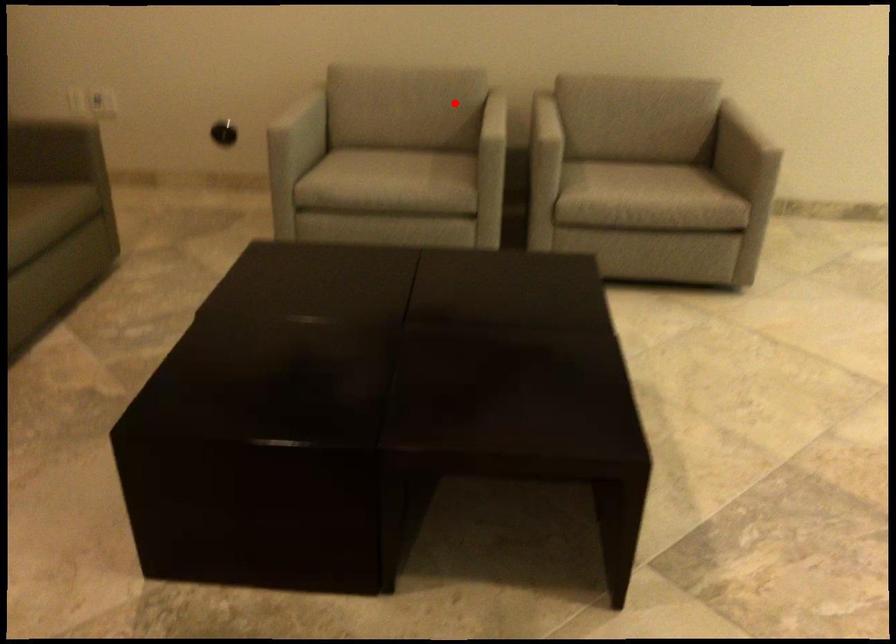
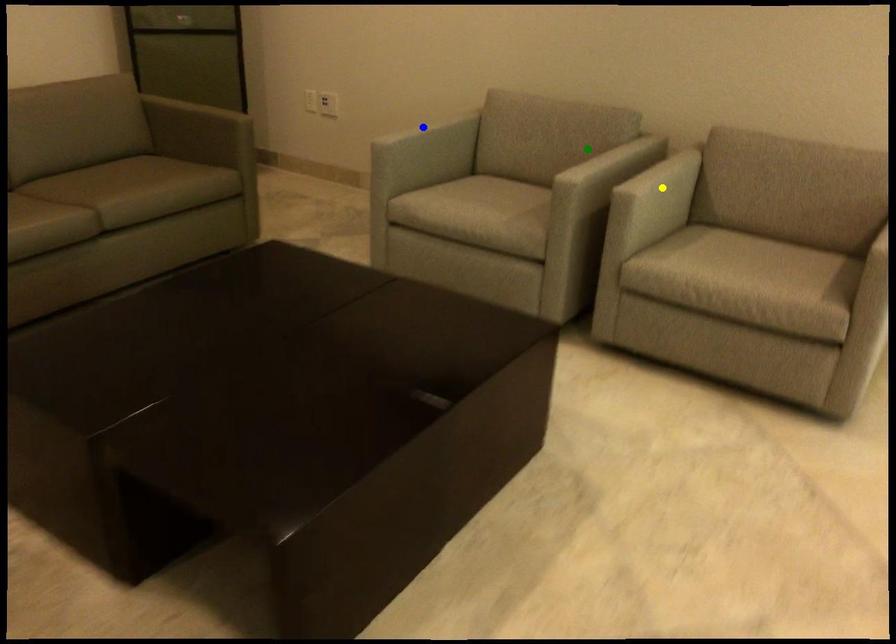
Question: I am providing you with two images of the same scene from different viewpoints. A red point is marked on the first image. You are given multiple points on the second image. Which point in image 2 is actually the same real-world point as the red point in image 1?

Choices:
 (A) blue point
 (B) yellow point
 (C) green point

Answer: (C)